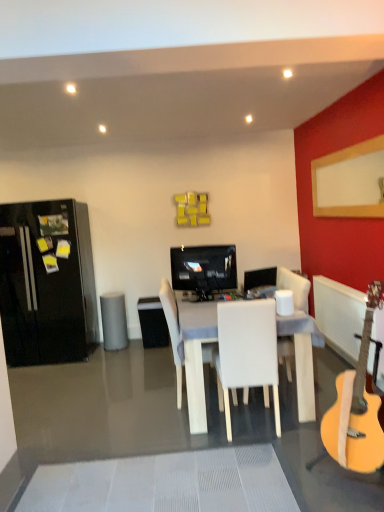
The width and height of the screenshot is (384, 512). What are the coordinates of `white matte chair at center, marked as the second chair in a back-to-front arrangement` in the screenshot? It's located at (247, 353).

What do you see at coordinates (204, 269) in the screenshot? The height and width of the screenshot is (512, 384). I see `matte black television at center` at bounding box center [204, 269].

What do you see at coordinates (260, 278) in the screenshot?
I see `satin black monitor at center` at bounding box center [260, 278].

Where is `satin black monitor at center`? satin black monitor at center is located at coordinates (260, 278).

Describe the element at coordinates (47, 283) in the screenshot. I see `black glossy refrigerator at left` at that location.

The width and height of the screenshot is (384, 512). Describe the element at coordinates (172, 331) in the screenshot. I see `white leather chair at center, the second chair viewed from the front` at that location.

What is the approximate width of white wood desk at center?

white wood desk at center is 1.06 meters wide.

Locate an element on the screen. The height and width of the screenshot is (512, 384). light brown acoustic guitar at right is located at coordinates (357, 407).

Image resolution: width=384 pixels, height=512 pixels. What do you see at coordinates (357, 407) in the screenshot? I see `light brown acoustic guitar at right` at bounding box center [357, 407].

Locate an element on the screen. The width and height of the screenshot is (384, 512). white matte chair at center, marked as the second chair in a back-to-front arrangement is located at coordinates (247, 353).

From the picture: Are gray matte trash bin/can at center and matte black television at center beside each other?

No, gray matte trash bin/can at center is not touching matte black television at center.

Is point (117, 292) farther from camera compared to point (234, 288)?

Yes, point (117, 292) is behind point (234, 288).

How different are the orientations of gray matte trash bin/can at center and matte black television at center in degrees?

The angle between the facing direction of gray matte trash bin/can at center and the facing direction of matte black television at center is 14.7 degrees.

I want to click on trash bin/can behind the matte black television at center, so click(x=114, y=321).

Considering the positions of objects white matte chair at center, which ranks as the first chair in front-to-back order, and white plastic radiator at right in the image provided, who is in front, white matte chair at center, which ranks as the first chair in front-to-back order, or white plastic radiator at right?

white matte chair at center, which ranks as the first chair in front-to-back order.

Which is behind, point (254, 305) or point (316, 295)?

Positioned behind is point (316, 295).

From the image's perspective, which one is positioned higher, white matte chair at center, marked as the second chair in a back-to-front arrangement, or white plastic radiator at right?

white plastic radiator at right, from the image's perspective.

Which of these two, white wood desk at center or light brown acoustic guitar at right, is bigger?

white wood desk at center is bigger.

Is white wood desk at center next to light brown acoustic guitar at right?

white wood desk at center and light brown acoustic guitar at right are clearly separated.

From the image's perspective, between white wood desk at center and light brown acoustic guitar at right, who is located below?

From the image's view, white wood desk at center is below.

Which of these two, gray matte trash bin/can at center or light brown acoustic guitar at right, is bigger?

With larger size is light brown acoustic guitar at right.

How far apart are gray matte trash bin/can at center and light brown acoustic guitar at right?

The distance of gray matte trash bin/can at center from light brown acoustic guitar at right is 10.14 feet.

From the image's perspective, is gray matte trash bin/can at center above or below light brown acoustic guitar at right?

gray matte trash bin/can at center is below light brown acoustic guitar at right.

Are gray matte trash bin/can at center and light brown acoustic guitar at right far apart?

That's right, there is a large distance between gray matte trash bin/can at center and light brown acoustic guitar at right.

Is matte black television at center to the left of black glossy refrigerator at left from the viewer's perspective?

No.

From a real-world perspective, which is physically below, matte black television at center or black glossy refrigerator at left?

In real-world perspective, black glossy refrigerator at left is lower.

Can we say matte black television at center lies outside black glossy refrigerator at left?

Yes, matte black television at center is outside of black glossy refrigerator at left.

Between matte black television at center and black glossy refrigerator at left, which one is positioned behind?

black glossy refrigerator at left is further away from the camera.

Which is more to the left, black glossy refrigerator at left or white leather chair at center, the first chair viewed from the back?

Positioned to the left is black glossy refrigerator at left.

From a real-world perspective, is black glossy refrigerator at left physically located above or below white leather chair at center, the second chair viewed from the front?

Clearly, from a real-world perspective, black glossy refrigerator at left is above white leather chair at center, the second chair viewed from the front.

Does black glossy refrigerator at left have a smaller size compared to white leather chair at center, the first chair viewed from the back?

No, black glossy refrigerator at left is not smaller than white leather chair at center, the first chair viewed from the back.

Does gray matte trash bin/can at center have a lesser width compared to white wood desk at center?

Yes.

From a real-world perspective, is gray matte trash bin/can at center physically located above or below white wood desk at center?

Clearly, from a real-world perspective, gray matte trash bin/can at center is below white wood desk at center.

Based on the photo, is gray matte trash bin/can at center to the left or to the right of white wood desk at center in the image?

Clearly, gray matte trash bin/can at center is on the left of white wood desk at center in the image.

Considering the positions of point (120, 347) and point (309, 398), is point (120, 347) closer or farther from the camera than point (309, 398)?

Point (120, 347) is farther from the camera than point (309, 398).

This screenshot has height=512, width=384. What are the coordinates of `trash bin/can located on the left of matte black television at center` in the screenshot? It's located at (114, 321).

I want to click on chair in front of the white plastic radiator at right, so click(x=247, y=353).

Based on their spatial positions, is light brown acoustic guitar at right or black glossy refrigerator at left further from white plastic radiator at right?

black glossy refrigerator at left is positioned further to the anchor white plastic radiator at right.

Estimate the real-world distances between objects in this image. Which object is further from black glossy refrigerator at left, matte black television at center or white leather chair at center, the first chair viewed from the back?

white leather chair at center, the first chair viewed from the back, is positioned further to the anchor black glossy refrigerator at left.

Which object lies further to the anchor point light brown acoustic guitar at right, gray matte trash bin/can at center or white plastic radiator at right?

The object further to light brown acoustic guitar at right is gray matte trash bin/can at center.

When comparing their distances from light brown acoustic guitar at right, does white leather chair at center, the second chair viewed from the front, or white plastic radiator at right seem further?

white plastic radiator at right is further to light brown acoustic guitar at right.

Looking at the image, which one is located closer to white matte chair at center, marked as the second chair in a back-to-front arrangement, gray matte trash bin/can at center or white plastic radiator at right?

white plastic radiator at right lies closer to white matte chair at center, marked as the second chair in a back-to-front arrangement, than the other object.

From the image, which object appears to be nearer to white matte chair at center, which ranks as the first chair in front-to-back order, light brown acoustic guitar at right or black glossy refrigerator at left?

light brown acoustic guitar at right lies closer to white matte chair at center, which ranks as the first chair in front-to-back order, than the other object.

Looking at the image, which one is located closer to white wood desk at center, white plastic radiator at right or gray matte trash bin/can at center?

white plastic radiator at right lies closer to white wood desk at center than the other object.

Which object lies further to the anchor point light brown acoustic guitar at right, white matte chair at center, marked as the second chair in a back-to-front arrangement, or white leather chair at center, the second chair viewed from the front?

Among the two, white leather chair at center, the second chair viewed from the front, is located further to light brown acoustic guitar at right.

You are a GUI agent. You are given a task and a screenshot of the screen. Output one action in this format:
    pyautogui.click(x=<x>, y=<y>)
    Task: Click on the computer monitor between light brown acoustic guitar at right and gray matte trash bin/can at center from front to back
    This screenshot has height=512, width=384.
    Given the screenshot: What is the action you would take?
    pyautogui.click(x=260, y=278)

At what (x,y) coordinates should I click in order to perform the action: click on television between black glossy refrigerator at left and white plastic radiator at right. Please return your answer as a coordinate pair (x, y). The height and width of the screenshot is (512, 384). Looking at the image, I should click on (204, 269).

Find the location of a particular element. refrigerator positioned between white wood desk at center and gray matte trash bin/can at center from near to far is located at coordinates (47, 283).

Image resolution: width=384 pixels, height=512 pixels. Find the location of `computer monitor between white leather chair at center, the first chair viewed from the back, and white plastic radiator at right, in the horizontal direction`. computer monitor between white leather chair at center, the first chair viewed from the back, and white plastic radiator at right, in the horizontal direction is located at coordinates (260, 278).